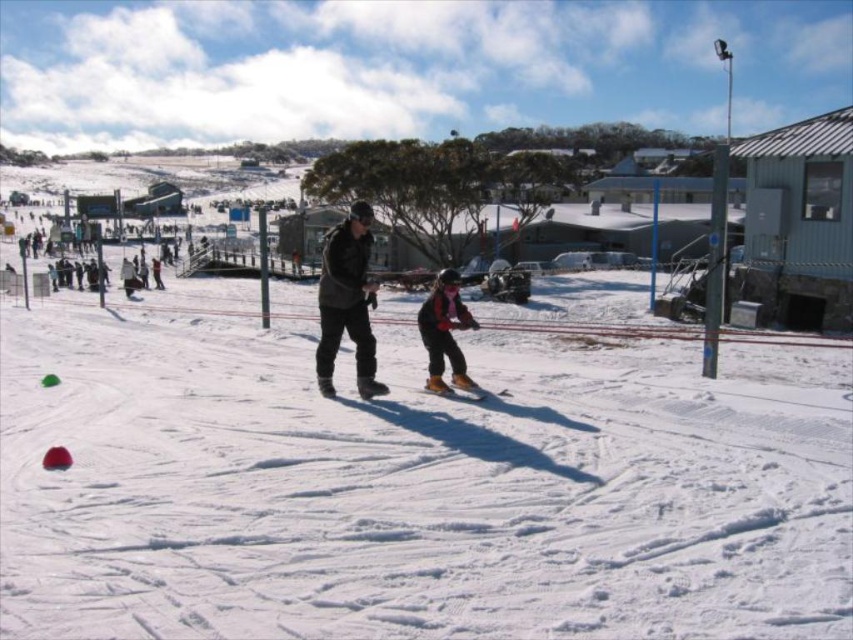
You are a skier preparing to put on your orange ski boots at center and shiny orange ski at center. Which item has a smaller width when viewed from above?

The orange ski boots at center is thinner than the shiny orange ski at center, so the orange ski boots at center has a smaller width when viewed from above.

You are a photographer trying to capture a photo of the dark gray jacket at center and the shiny orange ski at center. If you want to ensure both are fully visible in your shot, which object should you focus on first to avoid cropping either?

The dark gray jacket at center might be wider than shiny orange ski at center, so focusing on the wider object first would help ensure both are fully visible in the photo.

You are standing at the bottom of the slope and want to place a marker exactly where the orange ski boots at center are located. According to the coordinates given, what are the exact coordinates where you should place the marker?

The orange ski boots at center should be marked at the exact coordinates of point (444, 332).